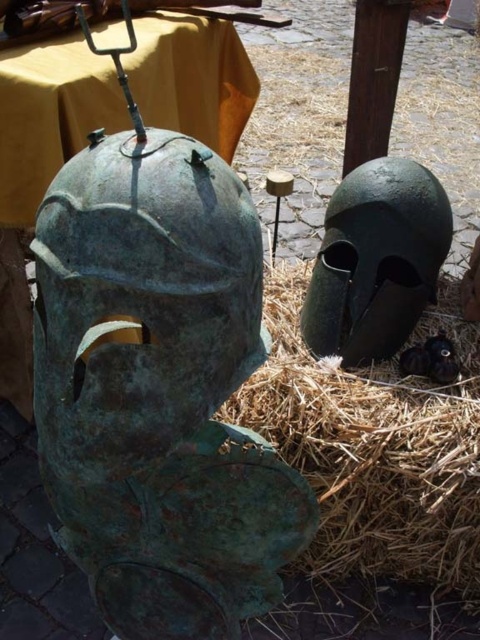
Can you confirm if green patinated bronze helmet at left is thinner than green patinated metal helmet at upper right?

No.

Who is shorter, green patinated bronze helmet at left or green patinated metal helmet at upper right?

green patinated metal helmet at upper right is shorter.

At what (x,y) coordinates should I click in order to perform the action: click on green patinated bronze helmet at left. Please return your answer as a coordinate pair (x, y). Looking at the image, I should click on (157, 388).

Where is `green patinated bronze helmet at left`? The height and width of the screenshot is (640, 480). green patinated bronze helmet at left is located at coordinates (157, 388).

Who is taller, green patinated bronze helmet at left or brown straw at center?

brown straw at center is taller.

Is green patinated bronze helmet at left bigger than brown straw at center?

No.

Which is behind, point (175, 179) or point (365, 500)?

The point (365, 500) is behind.

Where is `green patinated bronze helmet at left`? The height and width of the screenshot is (640, 480). green patinated bronze helmet at left is located at coordinates (157, 388).

What do you see at coordinates (374, 451) in the screenshot?
I see `brown straw at center` at bounding box center [374, 451].

The image size is (480, 640). Identify the location of brown straw at center. (374, 451).

Locate an element on the screen. brown straw at center is located at coordinates (374, 451).